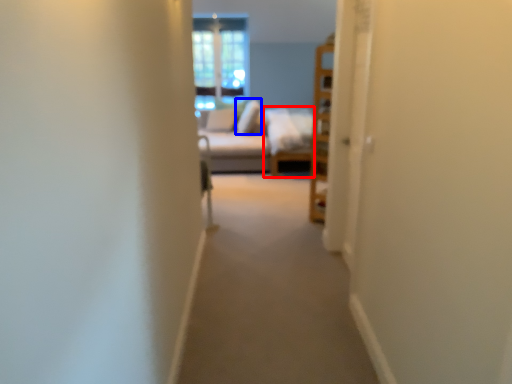
Question: Which object appears closest to the camera in this image, couch (highlighted by a red box) or pillow (highlighted by a blue box)?

Choices:
 (A) couch
 (B) pillow

Answer: (A)